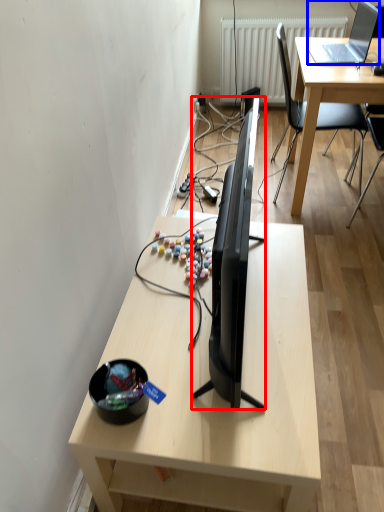
Question: Among these objects, which one is farthest to the camera, television (highlighted by a red box) or laptop (highlighted by a blue box)?

Choices:
 (A) television
 (B) laptop

Answer: (B)